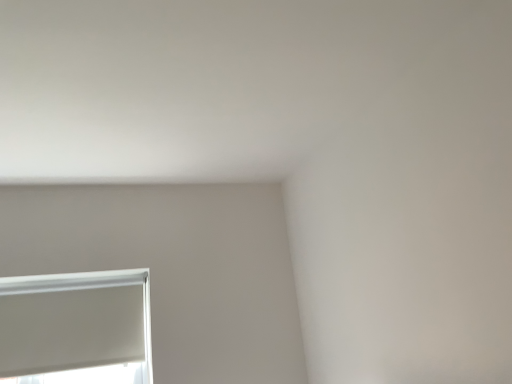
What do you see at coordinates (89, 288) in the screenshot?
I see `white matte window at lower left` at bounding box center [89, 288].

Image resolution: width=512 pixels, height=384 pixels. In order to click on white matte window at lower left in this screenshot , I will do `click(89, 288)`.

The image size is (512, 384). I want to click on white matte window at lower left, so click(89, 288).